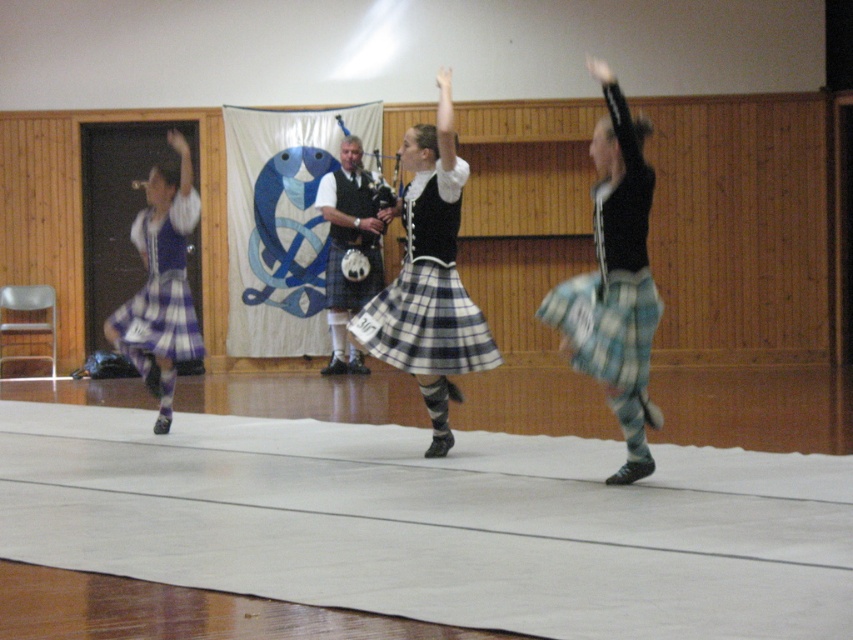
As an event planner, you need to place a decorative banner in the center of the wall behind the plaid skirt at center. Where should you position the banner to ensure it aligns with the skirt?

The plaid skirt at center is located at point (618, 276). To align the banner with the skirt, position it at the same coordinates.